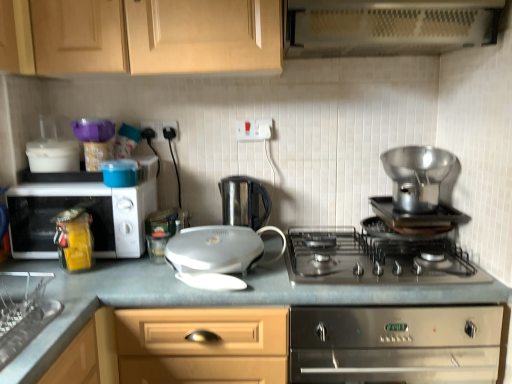
Question: Is matte wood cabinets at upper center taller than white plastic electrical outlet at upper center, which is the first electric outlet from right to left?

Choices:
 (A) yes
 (B) no

Answer: (A)

Question: Can you confirm if matte wood cabinets at upper center is shorter than white plastic electrical outlet at upper center, which is the first electric outlet from right to left?

Choices:
 (A) yes
 (B) no

Answer: (B)

Question: Does matte wood cabinets at upper center appear on the left side of white plastic electrical outlet at upper center, which is the first electric outlet from right to left?

Choices:
 (A) yes
 (B) no

Answer: (A)

Question: From the image's perspective, does matte wood cabinets at upper center appear lower than white plastic electrical outlet at upper center, the 2th electric outlet from the left?

Choices:
 (A) no
 (B) yes

Answer: (A)

Question: Does matte wood cabinets at upper center have a larger size compared to white plastic electrical outlet at upper center, the 2th electric outlet from the left?

Choices:
 (A) no
 (B) yes

Answer: (B)

Question: Is white plastic electrical outlet at upper center, the 2th electric outlet from the left, inside the boundaries of stainless steel cooker at center, or outside?

Choices:
 (A) inside
 (B) outside

Answer: (B)

Question: Considering the positions of white plastic electrical outlet at upper center, which is the first electric outlet from right to left, and stainless steel cooker at center in the image, is white plastic electrical outlet at upper center, which is the first electric outlet from right to left, wider or thinner than stainless steel cooker at center?

Choices:
 (A) wide
 (B) thin

Answer: (B)

Question: In terms of height, does white plastic electrical outlet at upper center, which is the first electric outlet from right to left, look taller or shorter compared to stainless steel cooker at center?

Choices:
 (A) tall
 (B) short

Answer: (B)

Question: In the image, is white plastic electrical outlet at upper center, the 2th electric outlet from the left, positioned in front of or behind stainless steel cooker at center?

Choices:
 (A) behind
 (B) front

Answer: (A)

Question: Visually, is white glossy sandwich maker at center, which ranks as the 1th kitchen appliance in left-to-right order, positioned to the left or to the right of white plastic electric outlet at upper center, which is the second electric outlet in right-to-left order?

Choices:
 (A) right
 (B) left

Answer: (A)

Question: Is white glossy sandwich maker at center, which ranks as the 1th kitchen appliance in left-to-right order, taller or shorter than white plastic electric outlet at upper center, which is the first electric outlet in left-to-right order?

Choices:
 (A) short
 (B) tall

Answer: (B)

Question: Looking at their shapes, would you say white glossy sandwich maker at center, which ranks as the 1th kitchen appliance in left-to-right order, is wider or thinner than white plastic electric outlet at upper center, which is the first electric outlet in left-to-right order?

Choices:
 (A) wide
 (B) thin

Answer: (A)

Question: Which is correct: white glossy sandwich maker at center, placed as the third kitchen appliance when sorted from right to left, is inside white plastic electric outlet at upper center, which is the second electric outlet in right-to-left order, or outside of it?

Choices:
 (A) inside
 (B) outside

Answer: (B)

Question: Is metallic perforated exhaust hood at upper center spatially inside stainless steel gas stove at center, or outside of it?

Choices:
 (A) outside
 (B) inside

Answer: (A)

Question: Considering their positions, is metallic perforated exhaust hood at upper center located in front of or behind stainless steel gas stove at center?

Choices:
 (A) behind
 (B) front

Answer: (B)